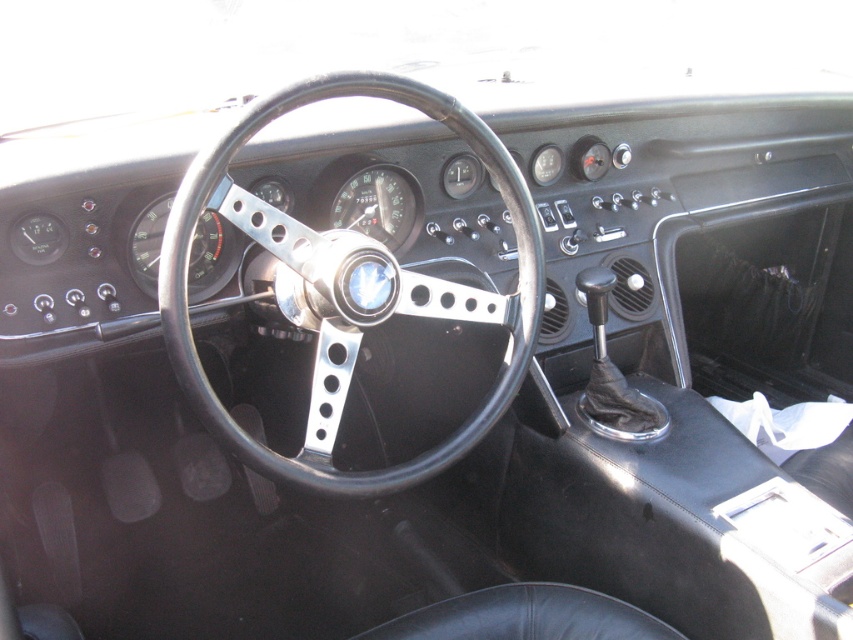
Question: Is black leather steering wheel at center below black leather seat at lower center?

Choices:
 (A) yes
 (B) no

Answer: (B)

Question: Among these points, which one is nearest to the camera?

Choices:
 (A) (215, 209)
 (B) (538, 616)

Answer: (A)

Question: Is black leather steering wheel at center bigger than black leather seat at lower center?

Choices:
 (A) yes
 (B) no

Answer: (A)

Question: Does black leather steering wheel at center come in front of black leather seat at lower center?

Choices:
 (A) no
 (B) yes

Answer: (B)